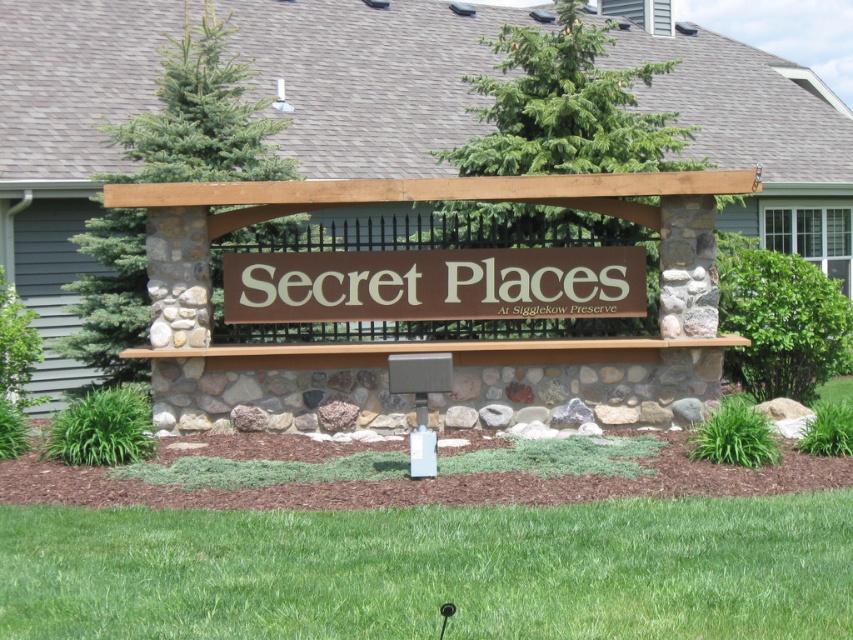
Question: Can you confirm if brown wood pergola at center is positioned to the left of brown matte sign at center?

Choices:
 (A) no
 (B) yes

Answer: (A)

Question: Is brown wood pergola at center closer to the viewer compared to brown matte sign at center?

Choices:
 (A) no
 (B) yes

Answer: (A)

Question: Can you confirm if brown wood pergola at center is bigger than brown matte sign at center?

Choices:
 (A) no
 (B) yes

Answer: (B)

Question: Which of the following is the farthest from the observer?

Choices:
 (A) brown matte sign at center
 (B) brown wood pergola at center

Answer: (B)